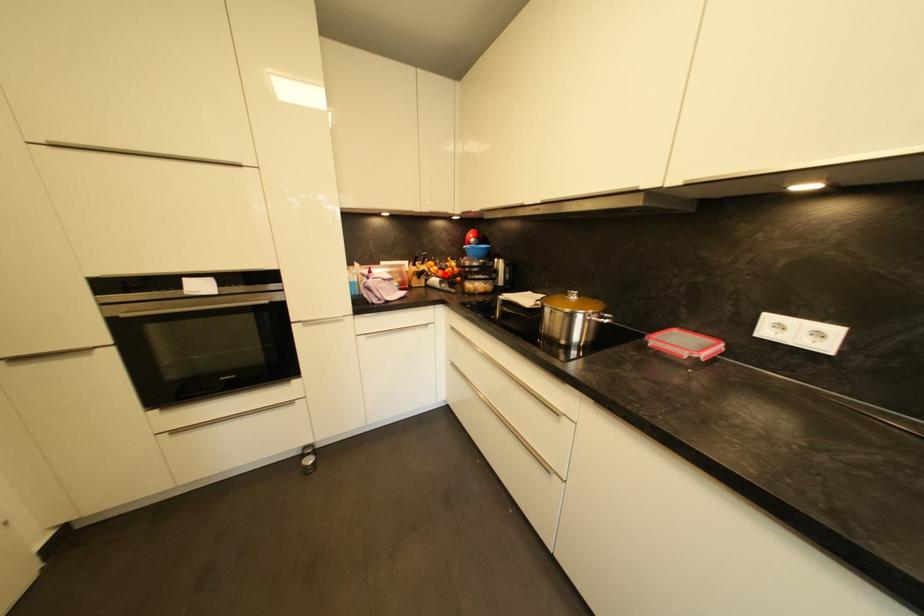
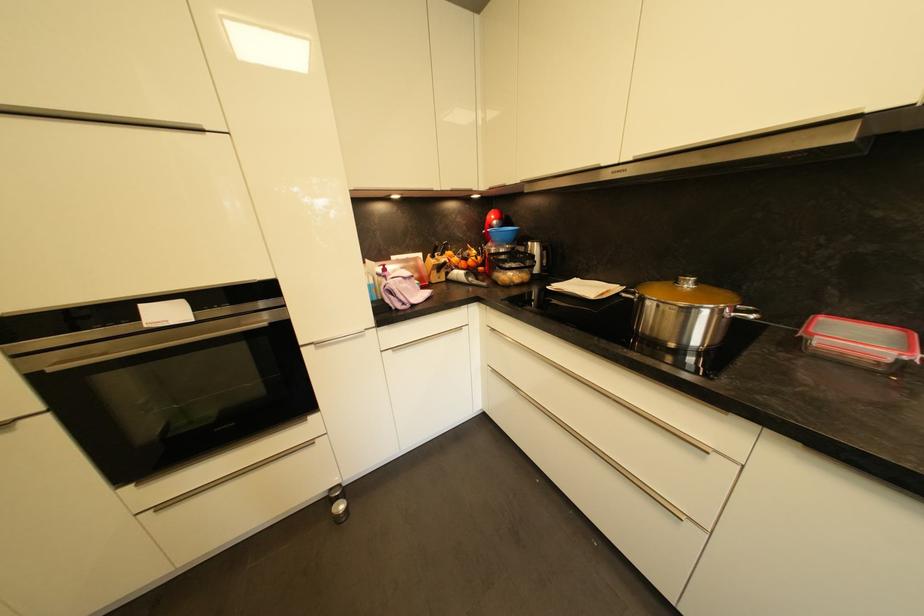
Locate, in the second image, the point that corresponds to the highlighted location in the first image.

(468, 265)